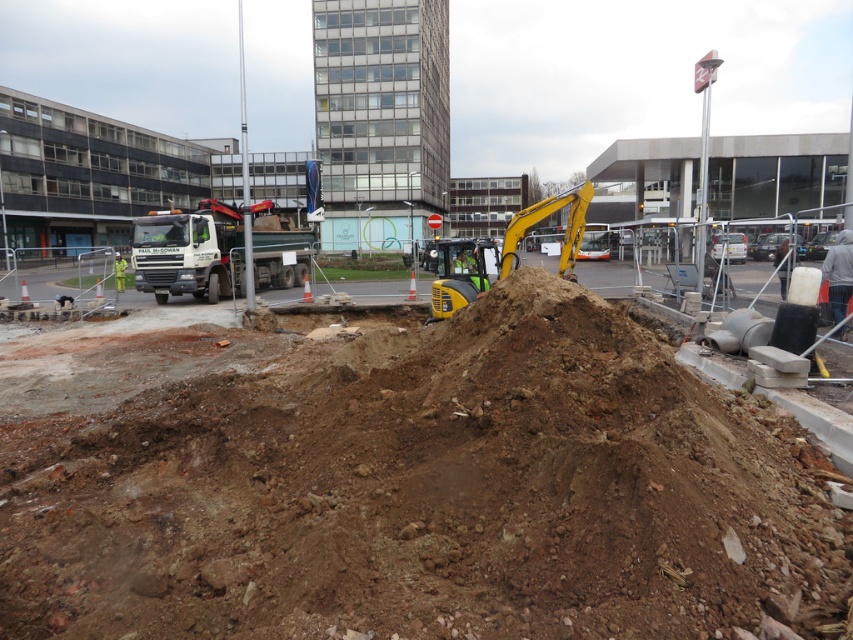
Which of these two, matte white truck at center or yellow rubber excavator at center, stands shorter?

yellow rubber excavator at center is shorter.

Can you confirm if matte white truck at center is bigger than yellow rubber excavator at center?

Yes.

The image size is (853, 640). In order to click on matte white truck at center in this screenshot , I will do `click(213, 253)`.

Can you confirm if brown earth at center is positioned to the right of yellow rubber excavator at center?

In fact, brown earth at center is to the left of yellow rubber excavator at center.

Is the position of brown earth at center less distant than that of yellow rubber excavator at center?

Yes, brown earth at center is closer to the viewer.

Which is behind, point (291, 616) or point (436, 285)?

The point (436, 285) is more distant.

Identify the location of brown earth at center. (401, 481).

Is brown earth at center bigger than matte white truck at center?

Yes.

Can you confirm if brown earth at center is positioned to the right of matte white truck at center?

Indeed, brown earth at center is positioned on the right side of matte white truck at center.

Locate an element on the screen. brown earth at center is located at coordinates click(x=401, y=481).